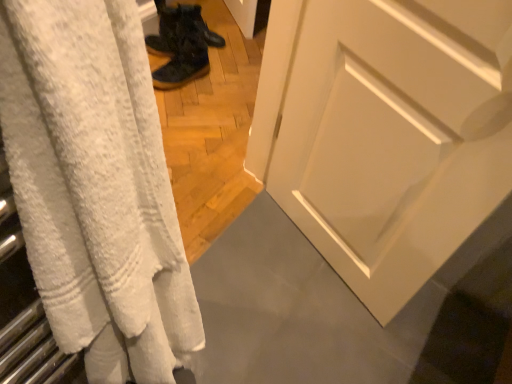
Question: Is dark matte boots at center, which is the 1th footwear from back to front, bigger or smaller than white textured towel at left?

Choices:
 (A) big
 (B) small

Answer: (B)

Question: In terms of width, does dark matte boots at center, placed as the 2th footwear when sorted from front to back, look wider or thinner when compared to white textured towel at left?

Choices:
 (A) thin
 (B) wide

Answer: (B)

Question: Which object is the closest to the dark matte boots at center, placed as the 2th footwear when sorted from front to back?

Choices:
 (A) camouflage fabric boots at center, marked as the first footwear in a front-to-back arrangement
 (B) white textured towel at left

Answer: (A)

Question: Which of these objects is positioned closest to the dark matte boots at center, which is the 1th footwear from back to front?

Choices:
 (A) camouflage fabric boots at center, marked as the first footwear in a front-to-back arrangement
 (B) white textured towel at left

Answer: (A)